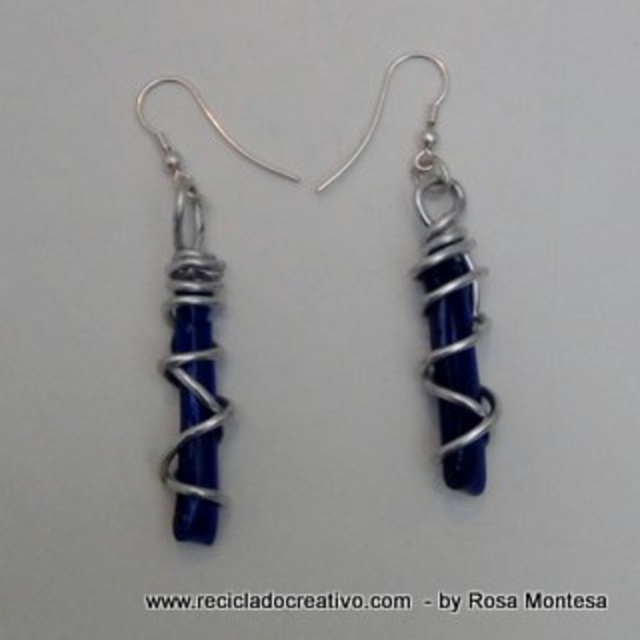
Consider the image. You are a jeweler examining the earrings. You need to determine which stone is bigger between the satin blue stone at center and the blue glass stone at left. Which one is larger?

The blue glass stone at left is larger than the satin blue stone at center.

You are an earring designer who wants to place a new pendant between the satin blue stone at center and the blue glass stone at left. Based on their positions, where should the pendant be placed?

The satin blue stone at center is positioned over the blue glass stone at left, so the pendant should be placed between them, below the satin blue stone at center and above the blue glass stone at left.